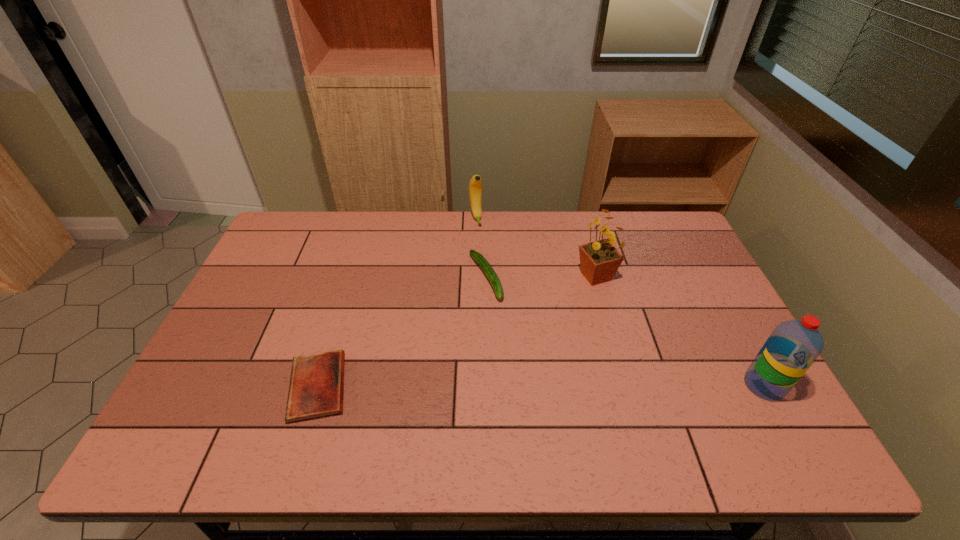
Find the location of a particular element. object that is at the right edge is located at coordinates (794, 345).

The width and height of the screenshot is (960, 540). I want to click on object that is at the near right corner, so click(794, 345).

I want to click on free region at the far edge of the desktop, so click(607, 214).

Find the location of a particular element. The height and width of the screenshot is (540, 960). free space at the near edge of the desktop is located at coordinates (255, 405).

I want to click on free spot at the left edge of the desktop, so click(x=246, y=302).

Identify the location of free space at the right edge of the desktop. This screenshot has width=960, height=540. (683, 315).

Find the location of a particular element. The width and height of the screenshot is (960, 540). free point at the far left corner is located at coordinates (324, 222).

Find the location of a particular element. This screenshot has width=960, height=540. free space between the banana and the diary is located at coordinates (396, 302).

This screenshot has width=960, height=540. Identify the location of vacant region between the diary and the third shortest object. (396, 302).

This screenshot has width=960, height=540. I want to click on vacant space that's between the water bottle and the fourth object from left to right, so click(x=680, y=331).